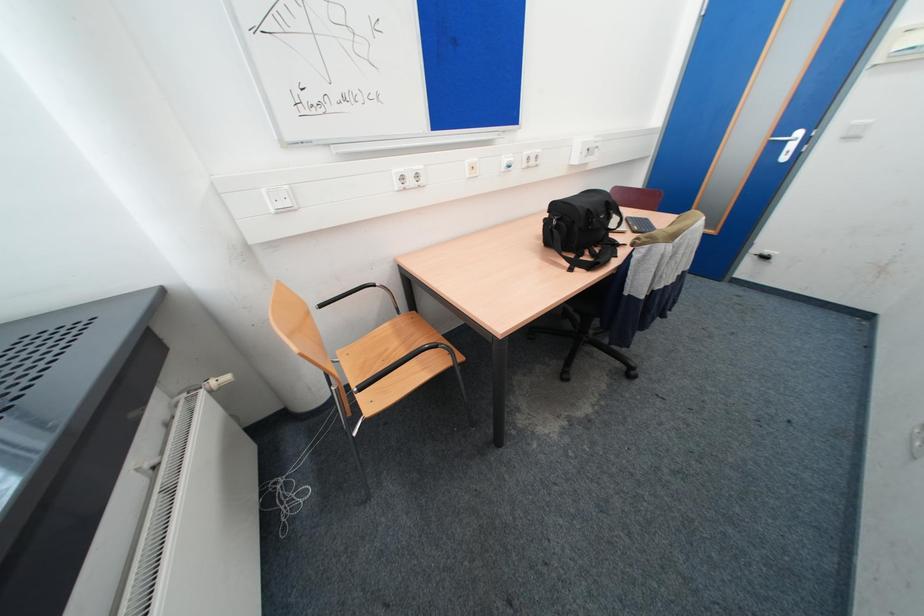
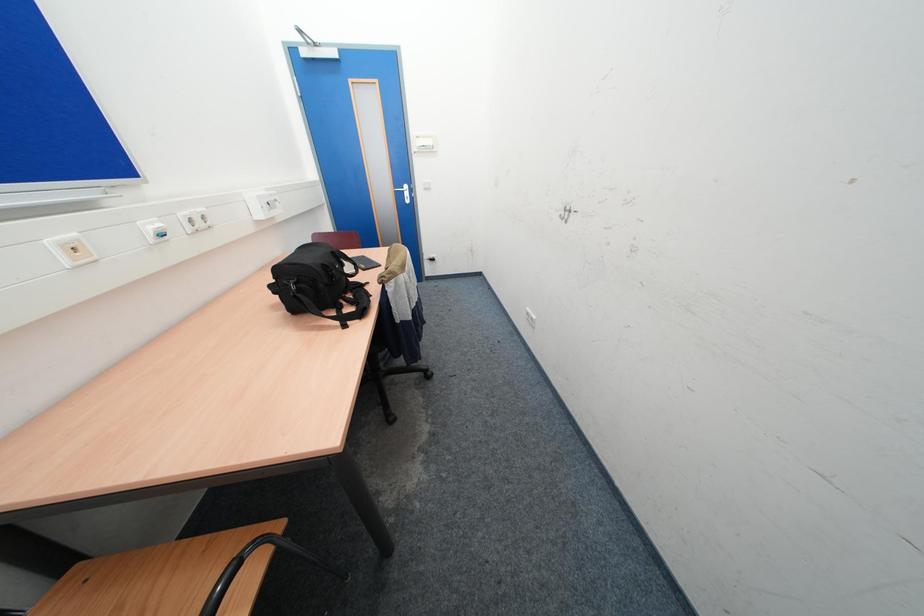
Question: The images are taken continuously from a first-person perspective. In which direction is your viewpoint rotating?

Choices:
 (A) Left
 (B) Right
 (C) Up
 (D) Down

Answer: (B)